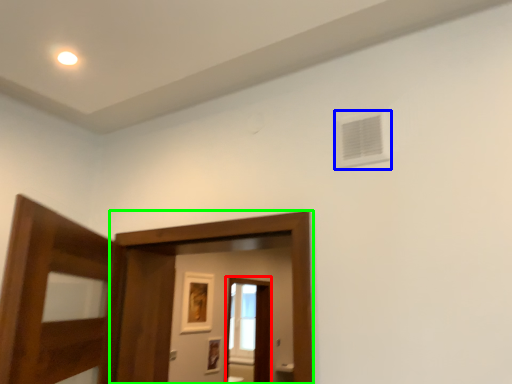
Question: Which object is positioned farthest from screen door (highlighted by a red box)? Select from air conditioning (highlighted by a blue box) and screen door (highlighted by a green box).

Choices:
 (A) air conditioning
 (B) screen door

Answer: (A)